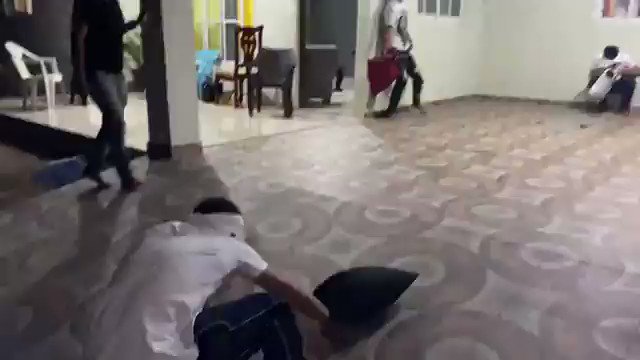
Where is `blank wall`? The width and height of the screenshot is (640, 360). blank wall is located at coordinates (513, 58).